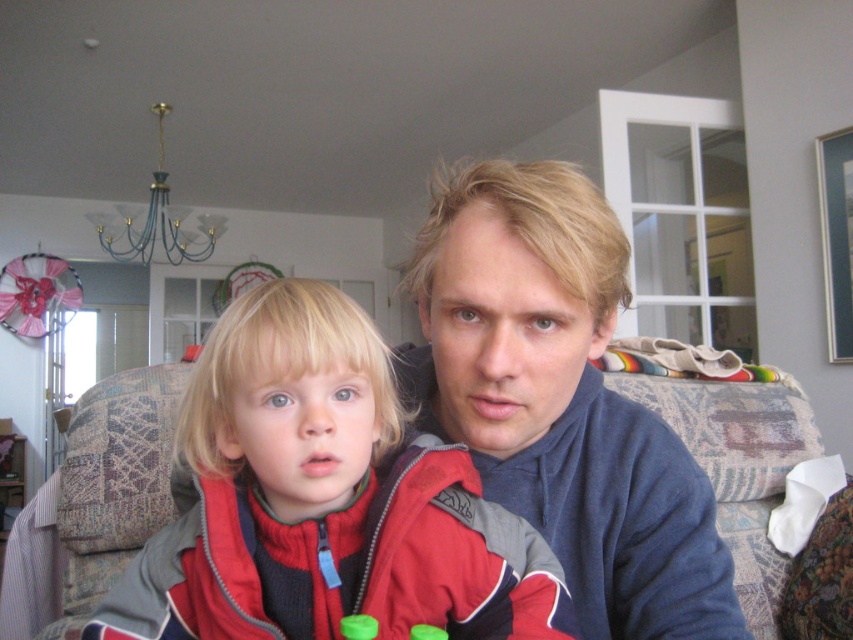
Who is more distant from viewer, [434,486] or [572,385]?

Positioned behind is point [572,385].

Is point (537, 564) closer to viewer compared to point (616, 548)?

Yes.

This screenshot has height=640, width=853. Identify the location of matte red jacket at center. click(x=322, y=499).

The image size is (853, 640). In order to click on matte red jacket at center in this screenshot , I will do `click(322, 499)`.